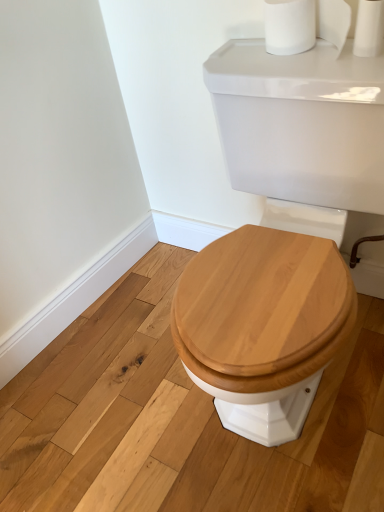
Where is `vacant space situated on the left part of white glossy porcelain at center`? The height and width of the screenshot is (512, 384). vacant space situated on the left part of white glossy porcelain at center is located at coordinates (104, 391).